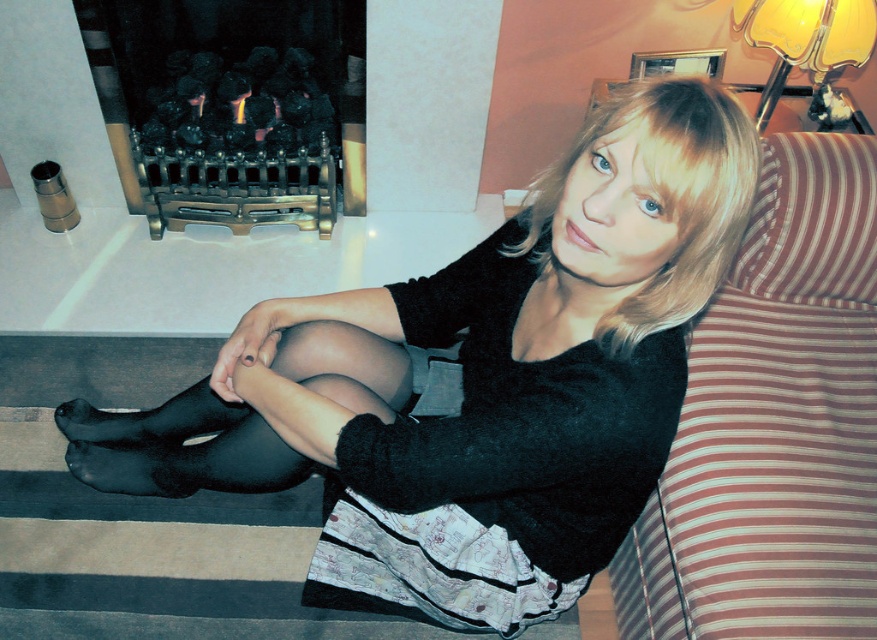
Question: Which point is farther to the camera?

Choices:
 (A) striped fabric couch at right
 (B) black matte stocking at lower left
 (C) black matte fireplace at upper left
 (D) matte black tights at lower left

Answer: (C)

Question: Which point is farther from the camera taking this photo?

Choices:
 (A) (75, 442)
 (B) (733, 582)
 (C) (123, 148)
 (D) (386, 529)

Answer: (C)

Question: Which point appears farthest from the camera in this image?

Choices:
 (A) (346, 308)
 (B) (487, 248)
 (C) (161, 426)

Answer: (C)

Question: Is striped fabric couch at right wider than black matte stocking at lower left?

Choices:
 (A) yes
 (B) no

Answer: (B)

Question: Is striped fabric couch at right wider than black matte fireplace at upper left?

Choices:
 (A) no
 (B) yes

Answer: (A)

Question: From the image, what is the correct spatial relationship of striped fabric couch at right in relation to black matte stocking at lower left?

Choices:
 (A) below
 (B) above

Answer: (B)